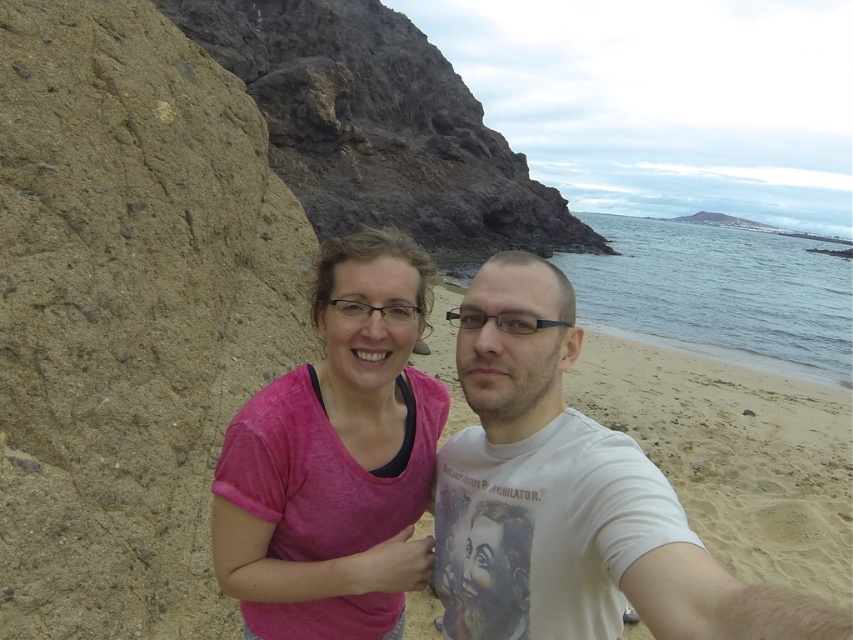
You are a photographer standing at the camera position in the scene. You want to capture a closeup shot of the pink fabric at center. Given that your camera can focus on objects within 5 meters, will you be able to take the closeup photo?

The pink fabric at center is 5.58 meters away from the camera, which is beyond the camera focus range of 5 meters. Therefore, you cannot take the closeup photo.